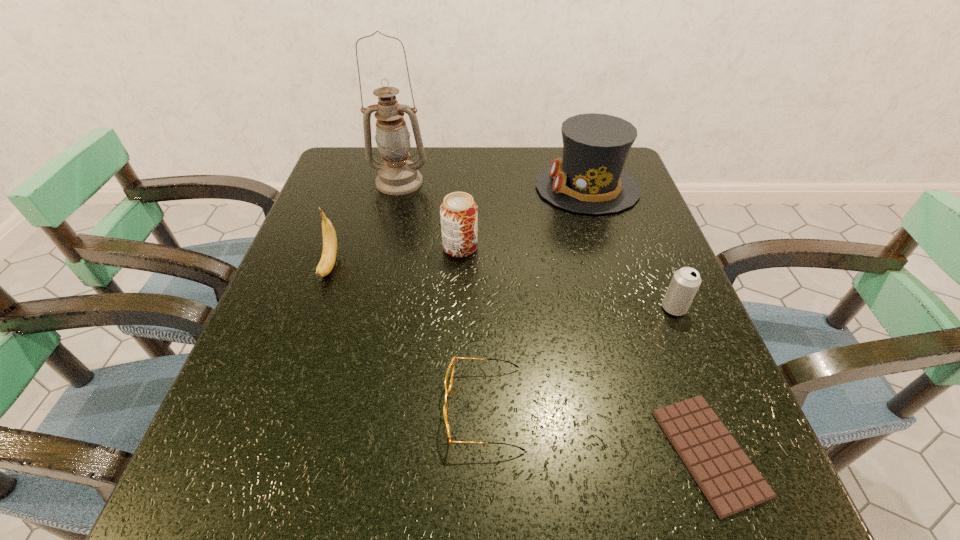
In order to click on vacant region between the second shortest object and the dress hat in this screenshot , I will do coord(536,298).

What are the coordinates of `free space between the left beer can and the spectacles` in the screenshot? It's located at (472, 327).

Locate an element on the screen. free spot between the dress hat and the fifth farthest object is located at coordinates (631, 248).

Image resolution: width=960 pixels, height=540 pixels. I want to click on free space between the banana and the second shortest object, so (x=407, y=336).

The height and width of the screenshot is (540, 960). Find the location of `empty space between the fifth tallest object and the leftmost object`. empty space between the fifth tallest object and the leftmost object is located at coordinates (502, 287).

This screenshot has height=540, width=960. I want to click on vacant space that's between the right beer can and the chocolate bar, so click(x=691, y=380).

Identify the location of empty space that is in between the second object from left to right and the second tallest object. (493, 185).

Identify the location of object that is the sixth closest to the dress hat. (731, 483).

Image resolution: width=960 pixels, height=540 pixels. Find the location of `object that stands as the second closest to the leftmost object`. object that stands as the second closest to the leftmost object is located at coordinates (458, 212).

The width and height of the screenshot is (960, 540). I want to click on free location that satisfies the following two spatial constraints: 1. with goggles on the front of the dress hat; 2. at the start of the peel on the banana, so click(612, 265).